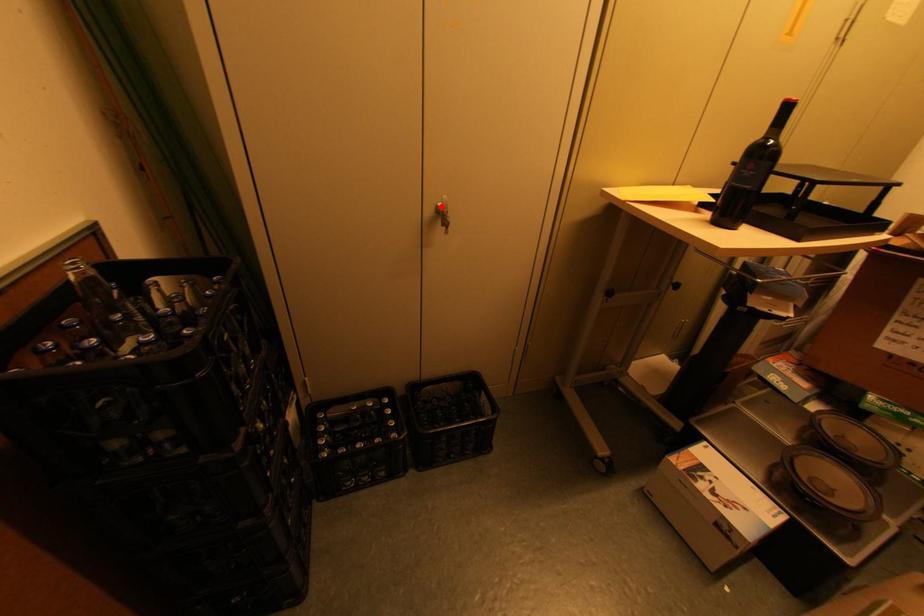
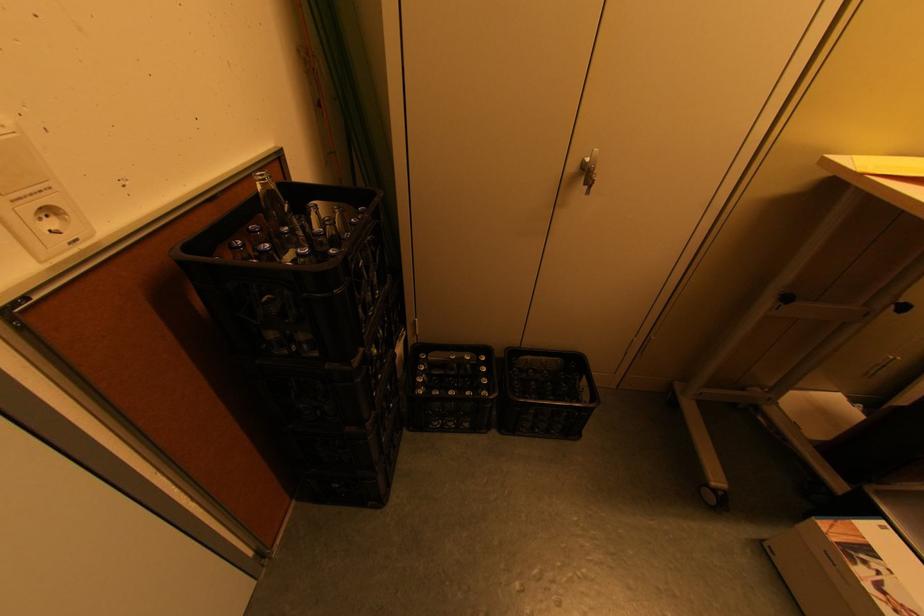
The point at the highlighted location is marked in the first image. Where is the corresponding point in the second image?

(587, 161)